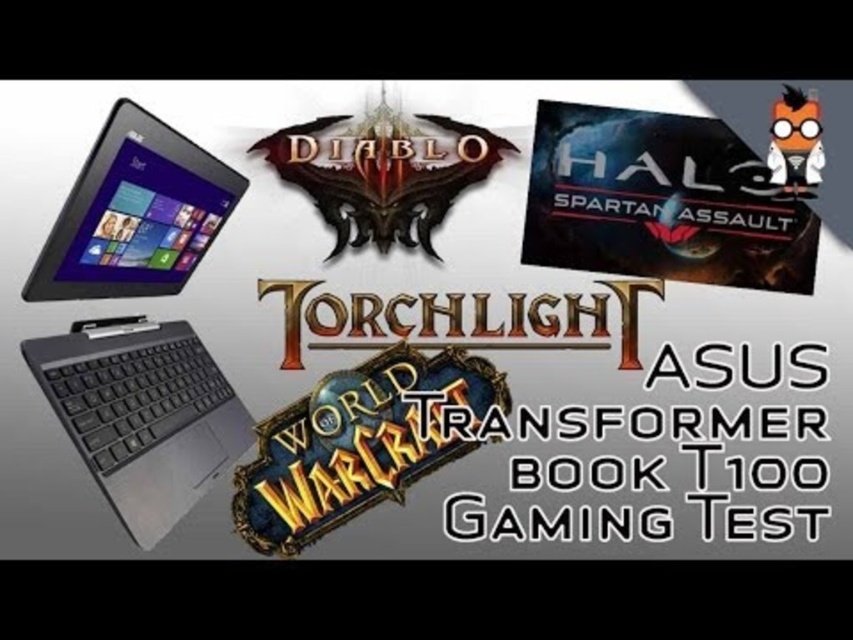
Question: Observing the image, what is the correct spatial positioning of black matte asus transformer book t100 at left in reference to matte black tablet at left?

Choices:
 (A) above
 (B) below

Answer: (B)

Question: Which of the following is the farthest from the observer?

Choices:
 (A) (131, 182)
 (B) (204, 157)

Answer: (B)

Question: Does black matte asus transformer book t100 at left appear under matte black tablet at left?

Choices:
 (A) yes
 (B) no

Answer: (A)

Question: Can you confirm if black matte asus transformer book t100 at left is bigger than matte black tablet at left?

Choices:
 (A) no
 (B) yes

Answer: (B)

Question: Which of the following is the farthest from the observer?

Choices:
 (A) (210, 476)
 (B) (218, 179)

Answer: (B)